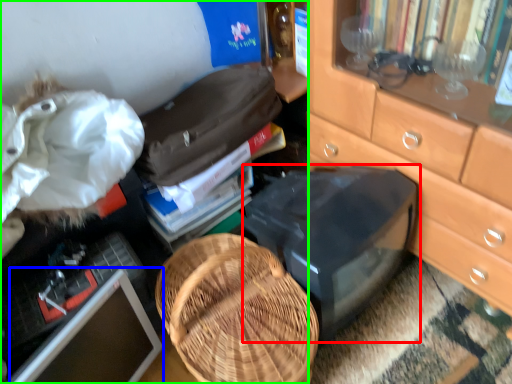
Question: Which object is positioned farthest from desktop (highlighted by a red box)? Select from computer monitor (highlighted by a blue box) and desk (highlighted by a green box).

Choices:
 (A) computer monitor
 (B) desk

Answer: (A)